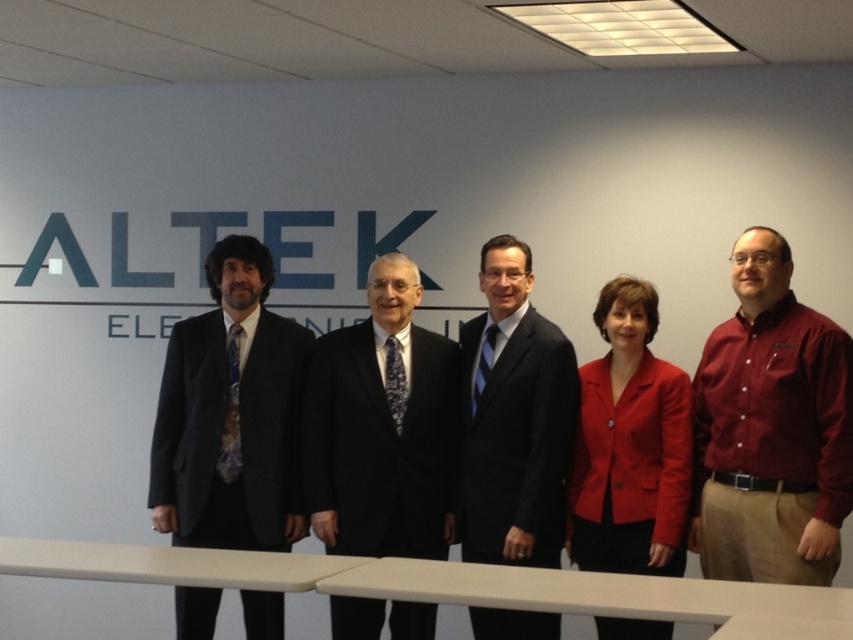
Is the position of black wool suit at left less distant than that of black suit at center?

That is False.

At what (x,y) coordinates should I click in order to perform the action: click on black wool suit at left. Please return your answer as a coordinate pair (x, y). Looking at the image, I should click on (228, 433).

This screenshot has width=853, height=640. What are the coordinates of `black wool suit at left` in the screenshot? It's located at (228, 433).

Is point (721, 467) positioned before point (689, 428)?

Yes, it is.

Can you confirm if maroon button-down shirt at right is smaller than red matte blazer at center?

No, maroon button-down shirt at right is not smaller than red matte blazer at center.

Is point (730, 330) positioned after point (621, 435)?

Yes, it is behind point (621, 435).

Locate an element on the screen. maroon button-down shirt at right is located at coordinates [770, 429].

Which is in front, point (842, 401) or point (229, 380)?

Point (842, 401) is more forward.

Identify the location of maroon button-down shirt at right. The width and height of the screenshot is (853, 640). (770, 429).

At what (x,y) coordinates should I click in order to perform the action: click on maroon button-down shirt at right. Please return your answer as a coordinate pair (x, y). This screenshot has width=853, height=640. Looking at the image, I should click on (770, 429).

Locate an element on the screen. This screenshot has width=853, height=640. maroon button-down shirt at right is located at coordinates (770, 429).